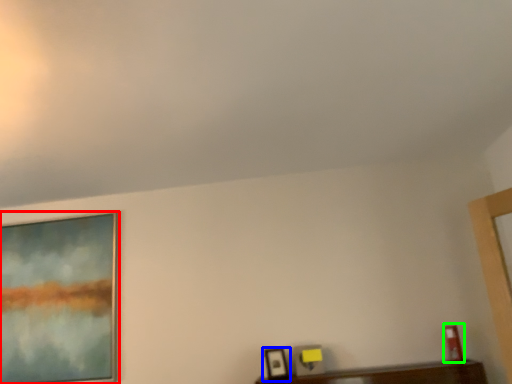
Question: Estimate the real-world distances between objects in this image. Which object is farther from picture frame (highlighted by a red box), picture frame (highlighted by a blue box) or picture frame (highlighted by a green box)?

Choices:
 (A) picture frame
 (B) picture frame

Answer: (B)